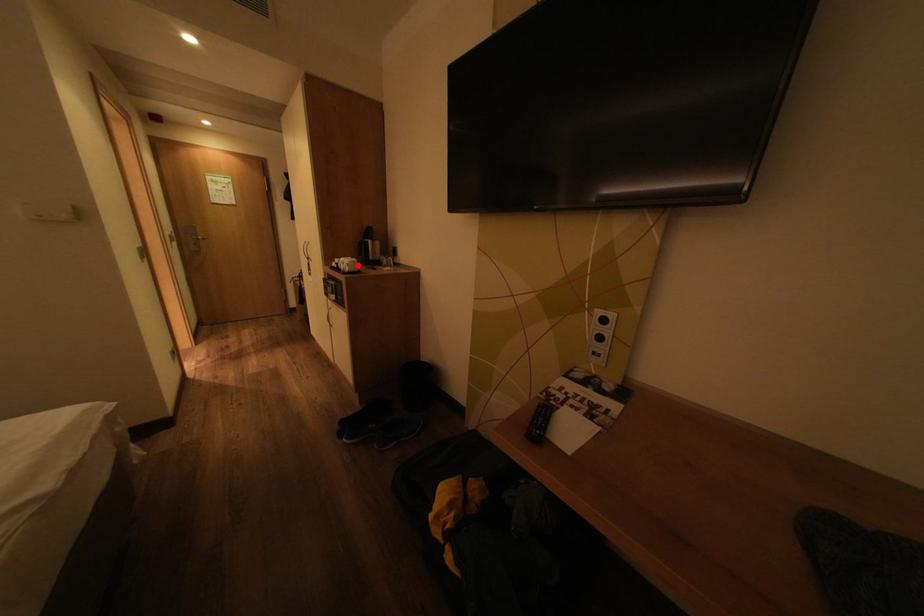
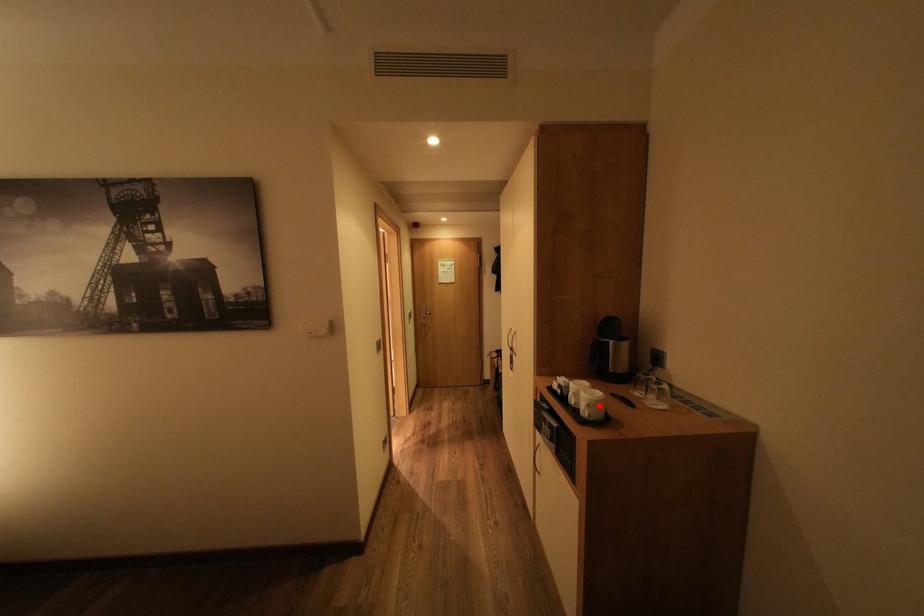
I am providing you with two images of the same scene from different viewpoints. A red point is marked on the first image and another point is marked on the second image. Is the marked point in image1 the same physical position as the marked point in image2?

Yes